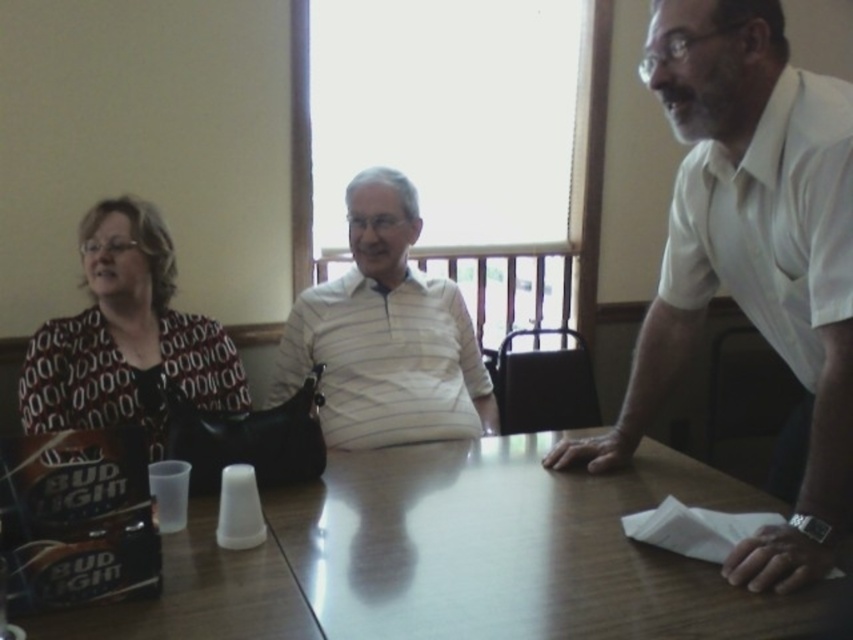
Between wooden table at center and white smooth shirt at right, which one has less height?

Standing shorter between the two is wooden table at center.

Can you confirm if wooden table at center is bigger than white smooth shirt at right?

No.

Is point (509, 436) more distant than point (787, 180)?

Yes, point (509, 436) is farther from viewer.

Locate an element on the screen. The width and height of the screenshot is (853, 640). wooden table at center is located at coordinates coord(456,557).

Does white smooth shirt at right have a greater width compared to white striped polo shirt at center?

Incorrect, white smooth shirt at right's width does not surpass white striped polo shirt at center's.

Does white smooth shirt at right have a larger size compared to white striped polo shirt at center?

Yes.

Is point (693, 273) farther from viewer compared to point (376, 364)?

That is False.

This screenshot has height=640, width=853. I want to click on white smooth shirt at right, so click(750, 253).

Who is shorter, white striped polo shirt at center or printed fabric blouse at left?

printed fabric blouse at left is shorter.

Is white striped polo shirt at center closer to camera compared to printed fabric blouse at left?

No, white striped polo shirt at center is further to the viewer.

Which is behind, point (401, 241) or point (161, 256)?

Positioned behind is point (401, 241).

The image size is (853, 640). What are the coordinates of `white striped polo shirt at center` in the screenshot? It's located at (386, 336).